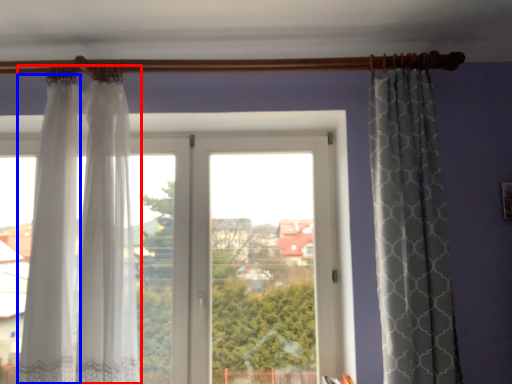
Question: Among these objects, which one is nearest to the camera, curtain (highlighted by a red box) or curtain (highlighted by a blue box)?

Choices:
 (A) curtain
 (B) curtain

Answer: (B)